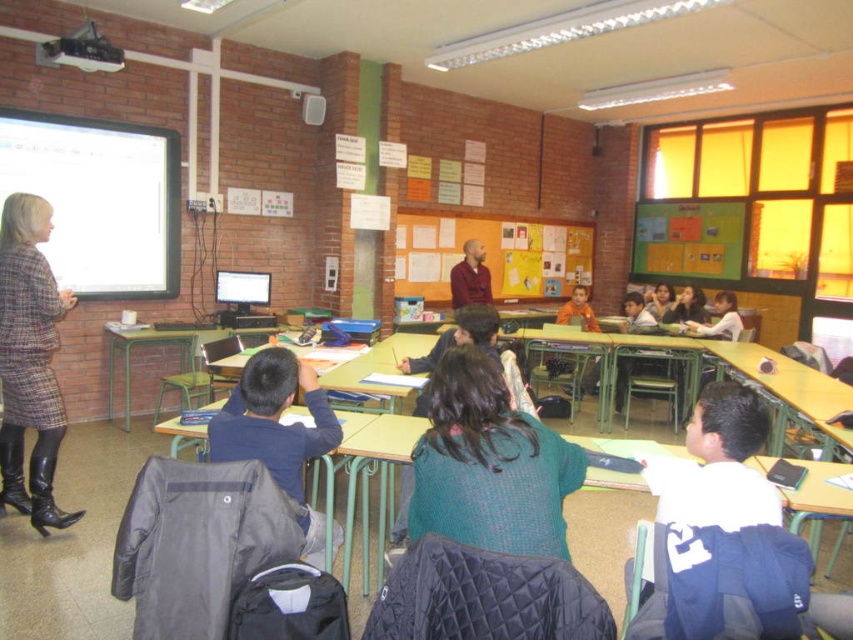
You are a student sitting at the back of the classroom. You notice two students wearing a dark blue shirt at center and a brown shirt at center. Which student is sitting closer to the front of the classroom?

The dark blue shirt at center is located below the brown shirt at center, so the student wearing the dark blue shirt at center is sitting closer to the front of the classroom.

You are a student sitting at your desk in the classroom. You notice two points marked on the wall. The first point is at coordinates point (x=541, y=467) and the second point is at point (x=836, y=422). Which point appears closer to you?

The point at coordinates point (x=541, y=467) is closer to you than the point at point (x=836, y=422) because it is nearer to the camera.

You are standing at the entrance of the classroom and notice a student wearing a dark blue shirt at center. If you want to approach them directly, which direction should you move relative to your current position?

The dark blue shirt at center is located at point 0.656 on the x and 0.321 on the y coordinates. Since the entrance is typically at the front of the classroom, moving towards the center would require walking forward and slightly to the right based on the coordinates provided.